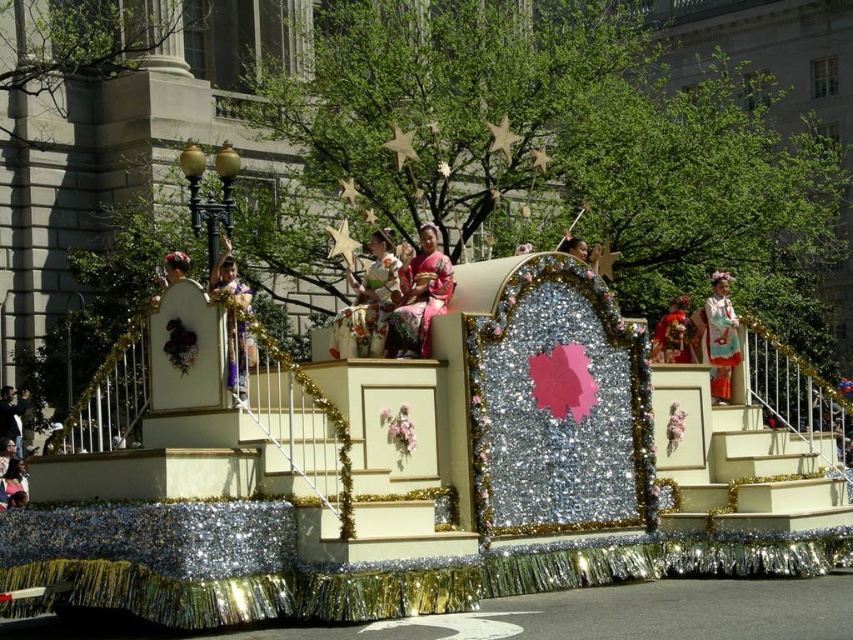
Question: From the image, what is the correct spatial relationship of pink silk kimono at center in relation to white floral kimono at center?

Choices:
 (A) below
 (B) above

Answer: (B)

Question: Is silky pink kimono at center bigger than dark blue fabric at lower left?

Choices:
 (A) no
 (B) yes

Answer: (B)

Question: Which point is closer to the camera taking this photo?

Choices:
 (A) (410, 280)
 (B) (717, 358)
 (C) (686, 332)
 (D) (369, 344)

Answer: (D)

Question: Is white floral kimono at center positioned at the back of dark blue fabric at lower left?

Choices:
 (A) no
 (B) yes

Answer: (A)

Question: Which object is the closest to the dark blue fabric at lower left?

Choices:
 (A) matte gold kimono at left
 (B) pink silk kimono at center

Answer: (A)

Question: Based on their relative distances, which object is nearer to the silky white kimono at center?

Choices:
 (A) silky pink kimono at center
 (B) matte gold kimono at left
 (C) white floral kimono at center

Answer: (B)